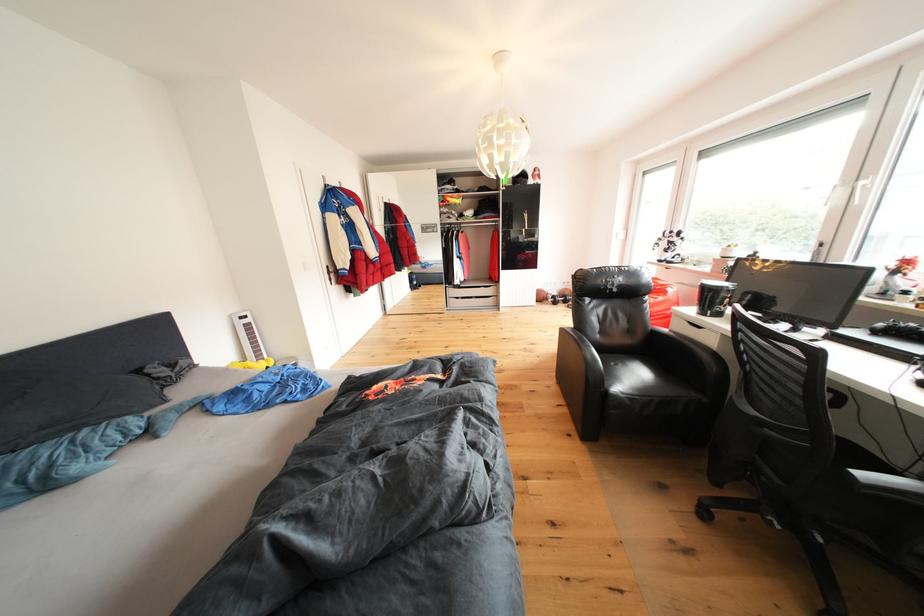
What do you see at coordinates (564, 298) in the screenshot?
I see `the metal dumbbell` at bounding box center [564, 298].